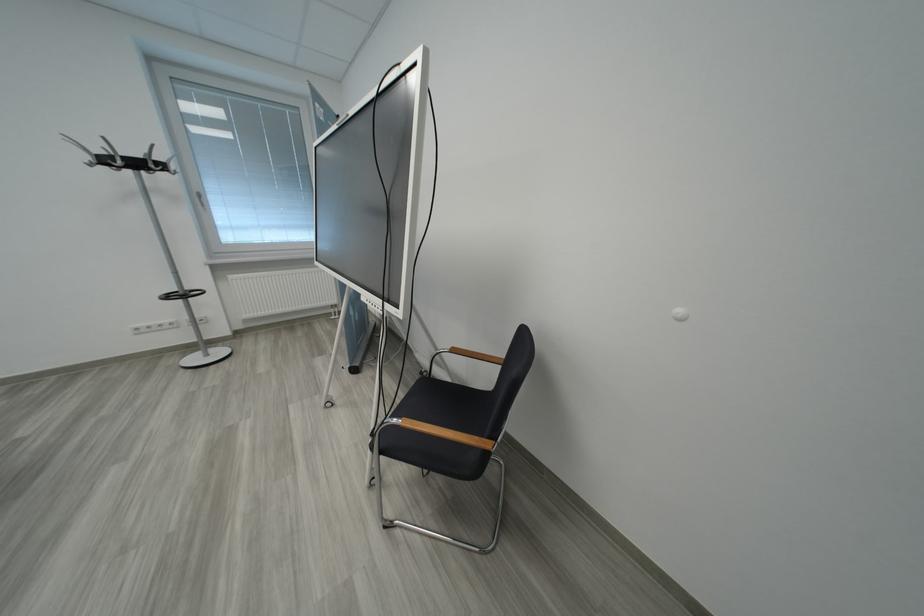
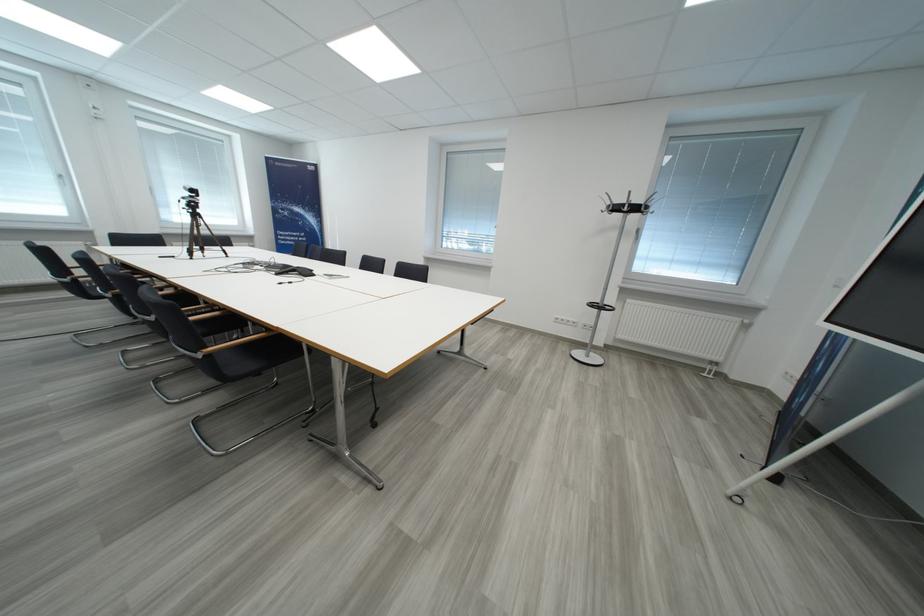
Question: The first image is from the beginning of the video and the second image is from the end. How did the camera likely rotate when shooting the video?

Choices:
 (A) Left
 (B) Right
 (C) Up
 (D) Down

Answer: (A)